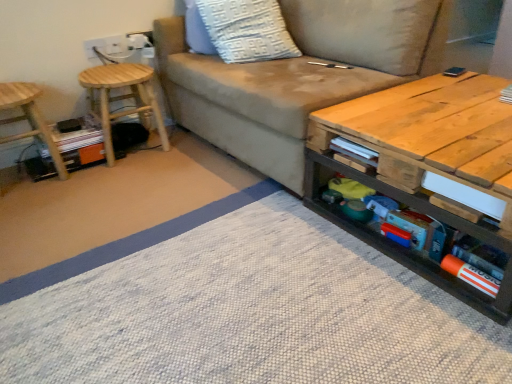
Where is `free space to the back side of white paper book at right, the 1th book from the top`? free space to the back side of white paper book at right, the 1th book from the top is located at coordinates (484, 83).